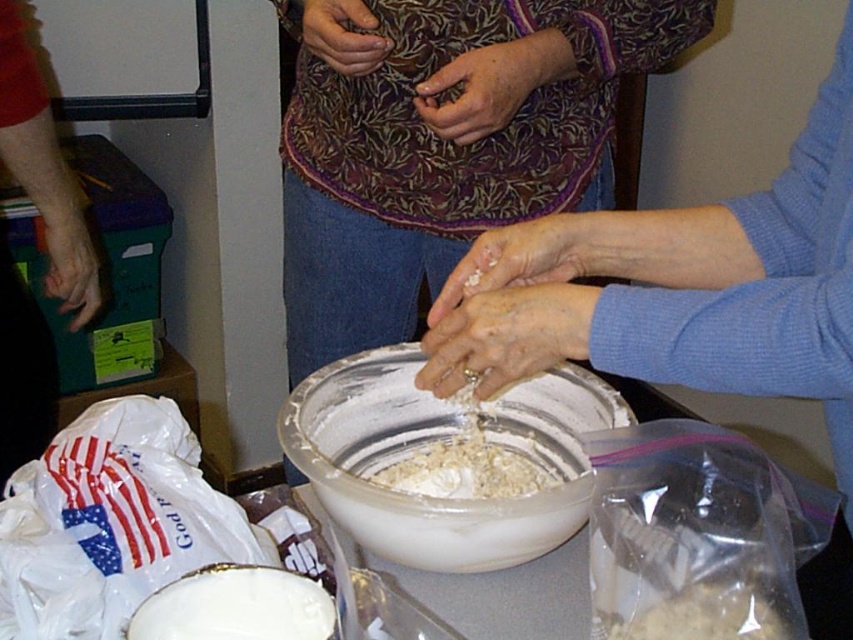
Is smooth white hands at center further to camera compared to matte floral fabric at center?

That is False.

Which is below, smooth white hands at center or matte floral fabric at center?

smooth white hands at center is lower down.

Is point (495, 294) positioned before point (488, 122)?

Yes, point (495, 294) is closer to viewer.

Find the location of a particular element. The image size is (853, 640). smooth white hands at center is located at coordinates (506, 337).

Does white powdery flour at center come behind smooth skin hand at lower left?

No, white powdery flour at center is in front of smooth skin hand at lower left.

Does white powdery flour at center have a lesser width compared to smooth skin hand at lower left?

Indeed, white powdery flour at center has a lesser width compared to smooth skin hand at lower left.

Measure the distance between point (x=434, y=458) and camera.

34.16 inches

Identify the location of white powdery flour at center. (465, 468).

Does white matte bowl at center have a greater height compared to white matte hands at center?

No, white matte bowl at center is not taller than white matte hands at center.

Does white matte bowl at center have a greater width compared to white matte hands at center?

In fact, white matte bowl at center might be narrower than white matte hands at center.

Image resolution: width=853 pixels, height=640 pixels. In order to click on white matte bowl at center in this screenshot , I will do `click(236, 605)`.